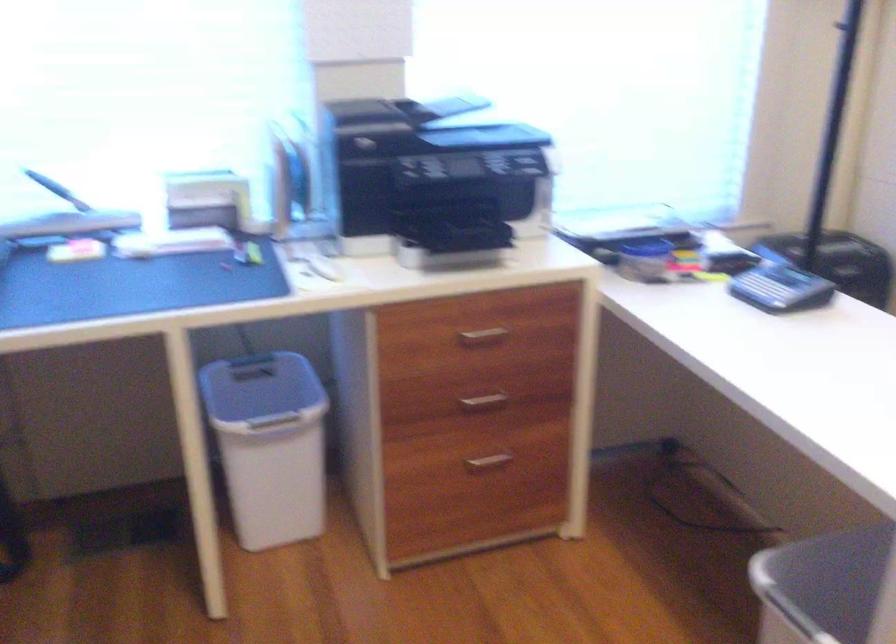
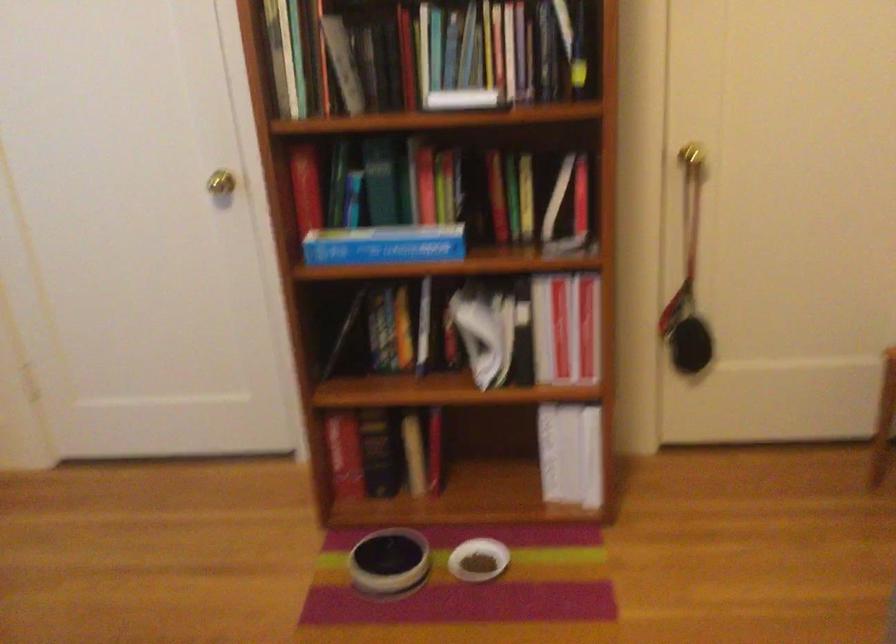
Question: The first image is from the beginning of the video and the second image is from the end. How did the camera likely rotate when shooting the video?

Choices:
 (A) Left
 (B) Right
 (C) Up
 (D) Down

Answer: (B)